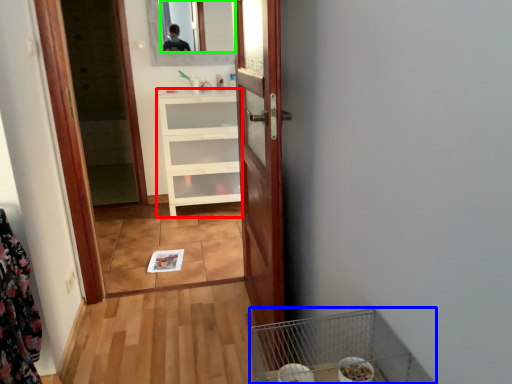
Question: Estimate the real-world distances between objects in this image. Which object is closer to cabinetry (highlighted by a red box), bird cage (highlighted by a blue box) or mirror (highlighted by a green box)?

Choices:
 (A) bird cage
 (B) mirror

Answer: (B)